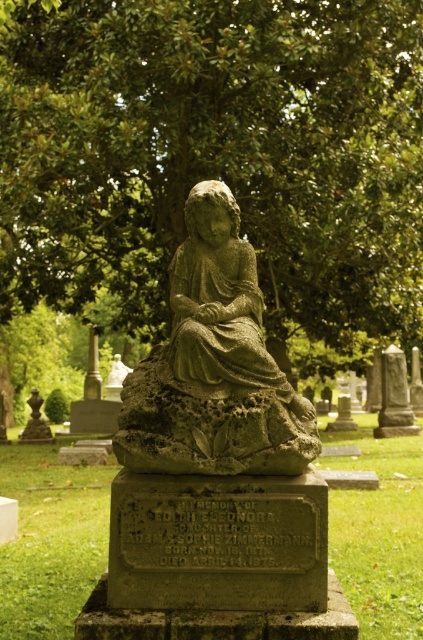
Question: Which point appears farthest from the camera in this image?

Choices:
 (A) (395, 356)
 (B) (30, 435)
 (C) (170, 237)

Answer: (B)

Question: Where is stone statue at center located in relation to green stone statue at center in the image?

Choices:
 (A) right
 (B) left

Answer: (B)

Question: Estimate the real-world distances between objects in this image. Which object is closer to the green stone statue at center?

Choices:
 (A) stone statue at center
 (B) green leafy tree at center

Answer: (A)

Question: Which of the following is the closest to the observer?

Choices:
 (A) (299, 454)
 (B) (222, 131)

Answer: (A)

Question: Can you confirm if stone statue at center is bigger than green stone statue at center?

Choices:
 (A) no
 (B) yes

Answer: (B)

Question: Does stone statue at center have a larger size compared to smooth gray stone at upper right?

Choices:
 (A) no
 (B) yes

Answer: (A)